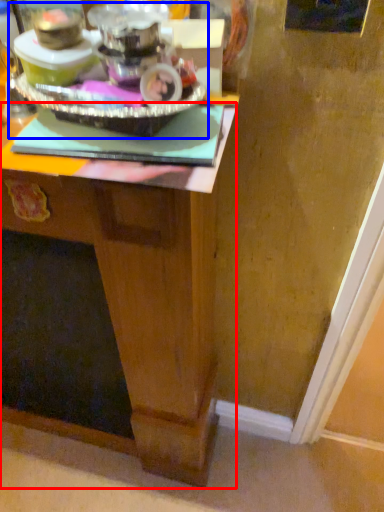
Question: Which point is further to the camera, desk (highlighted by a red box) or appliance (highlighted by a blue box)?

Choices:
 (A) desk
 (B) appliance

Answer: (A)